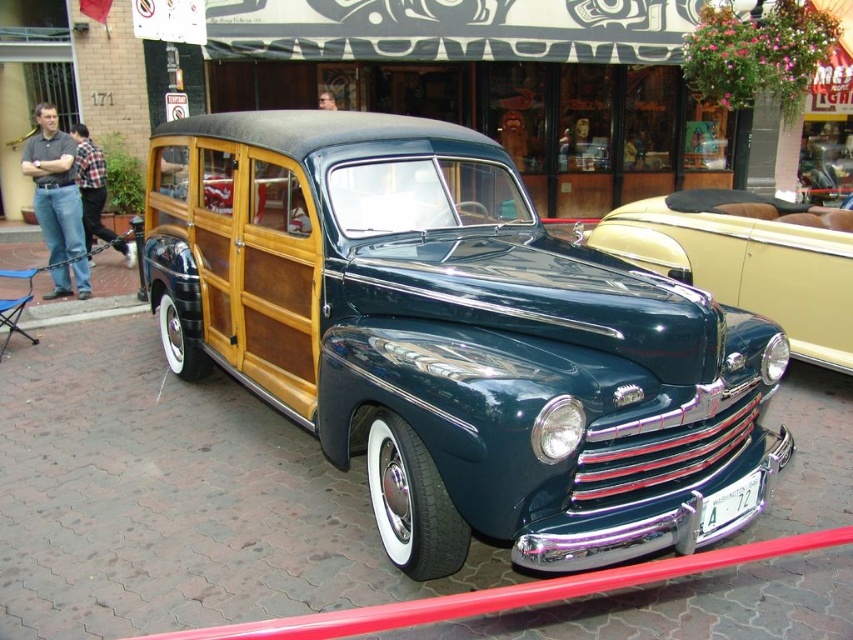
In the scene shown: Is shiny dark green wood paneling car at center above shiny dark green wood paneling at center?

No, shiny dark green wood paneling car at center is not above shiny dark green wood paneling at center.

Does shiny dark green wood paneling car at center appear on the right side of shiny dark green wood paneling at center?

No, shiny dark green wood paneling car at center is not to the right of shiny dark green wood paneling at center.

Image resolution: width=853 pixels, height=640 pixels. In order to click on shiny dark green wood paneling car at center in this screenshot , I will do `click(456, 340)`.

Find the location of a particular element. The width and height of the screenshot is (853, 640). shiny dark green wood paneling car at center is located at coordinates (456, 340).